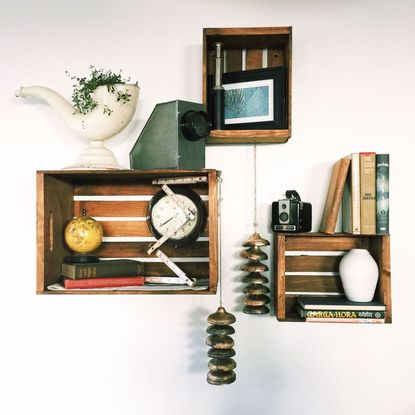
Identify the location of shelf. The height and width of the screenshot is (415, 415). (263, 49).